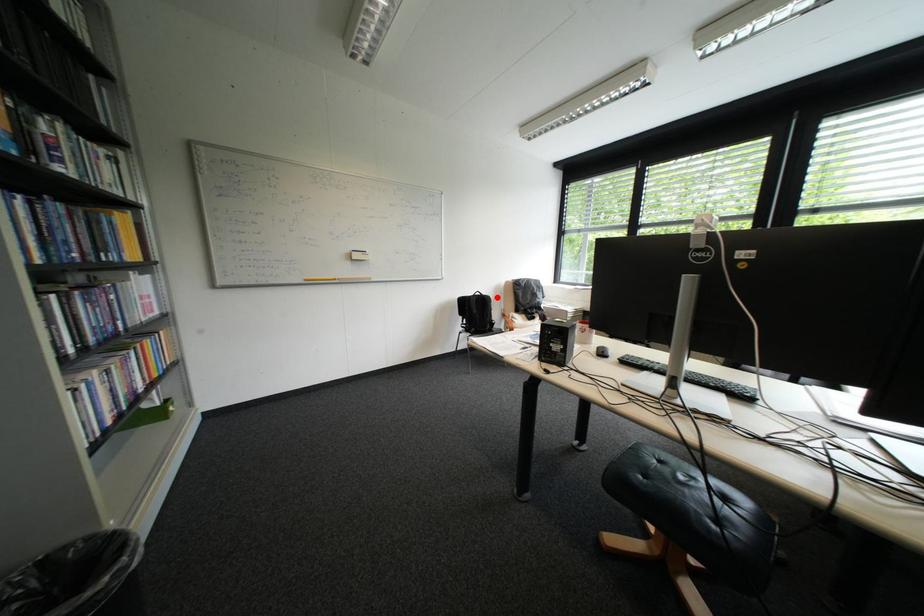
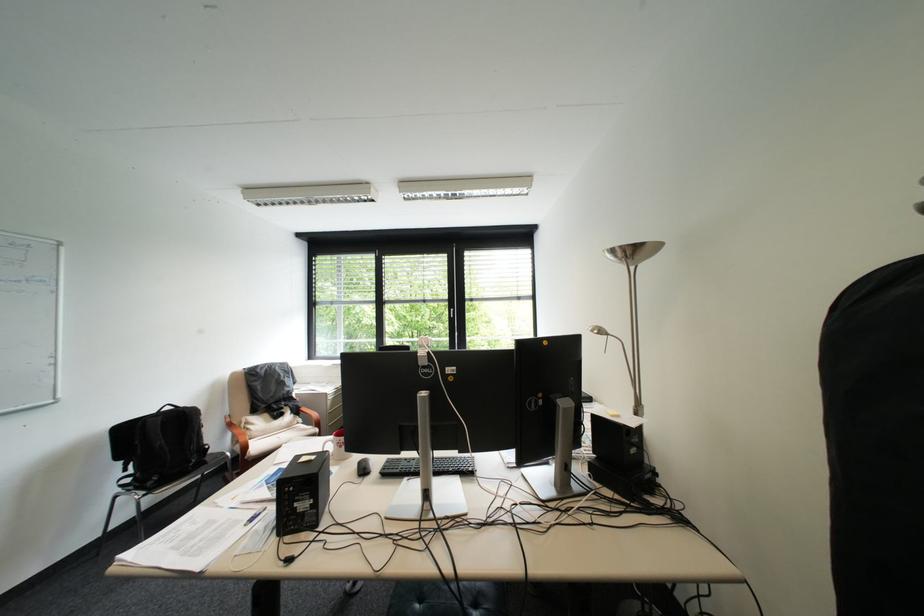
Where in the second image is the point corresponding to the highlighted location from the first image?

(198, 411)